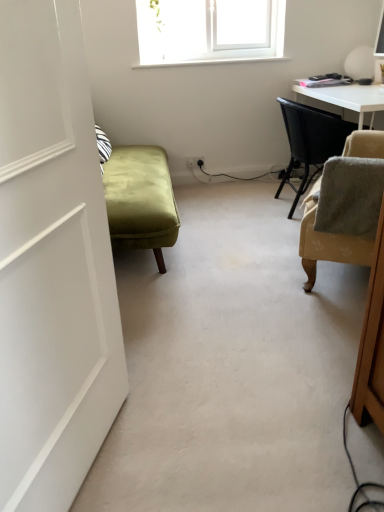
Question: Considering the relative positions of beige fabric chair at right, which is the first chair from front to back, and beige fabric chair at right, the first chair when ordered from back to front, in the image provided, is beige fabric chair at right, which is the first chair from front to back, to the left or to the right of beige fabric chair at right, the first chair when ordered from back to front,?

Choices:
 (A) left
 (B) right

Answer: (A)

Question: Is beige fabric chair at right, which is counted as the 2th chair, starting from the back, situated inside beige fabric chair at right, the first chair when ordered from back to front, or outside?

Choices:
 (A) inside
 (B) outside

Answer: (B)

Question: Which of these objects is positioned farthest from the white matte door at left?

Choices:
 (A) beige fabric chair at right, the first chair when ordered from back to front
 (B) beige fabric chair at right, which is counted as the 2th chair, starting from the back

Answer: (A)

Question: Based on their relative distances, which object is farther from the white matte door at left?

Choices:
 (A) beige fabric chair at right, which is counted as the 2th chair, starting from the back
 (B) beige fabric chair at right, the 2th chair when ordered from front to back

Answer: (B)